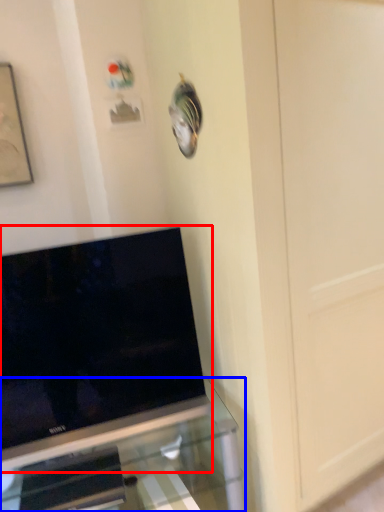
Question: Which object is further to the camera taking this photo, television (highlighted by a red box) or furniture (highlighted by a blue box)?

Choices:
 (A) television
 (B) furniture

Answer: (A)